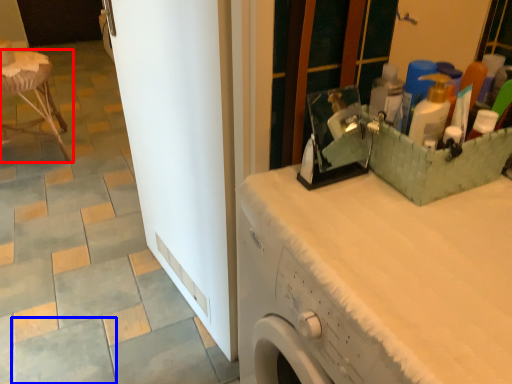
Question: Which object appears closest to the camera in this image, furniture (highlighted by a red box) or ceramic tile (highlighted by a blue box)?

Choices:
 (A) furniture
 (B) ceramic tile

Answer: (B)